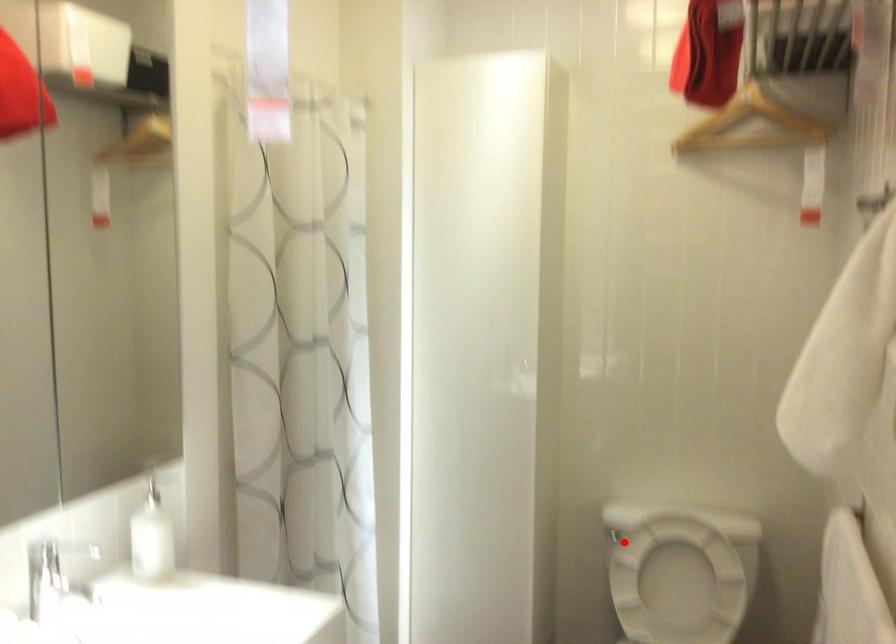
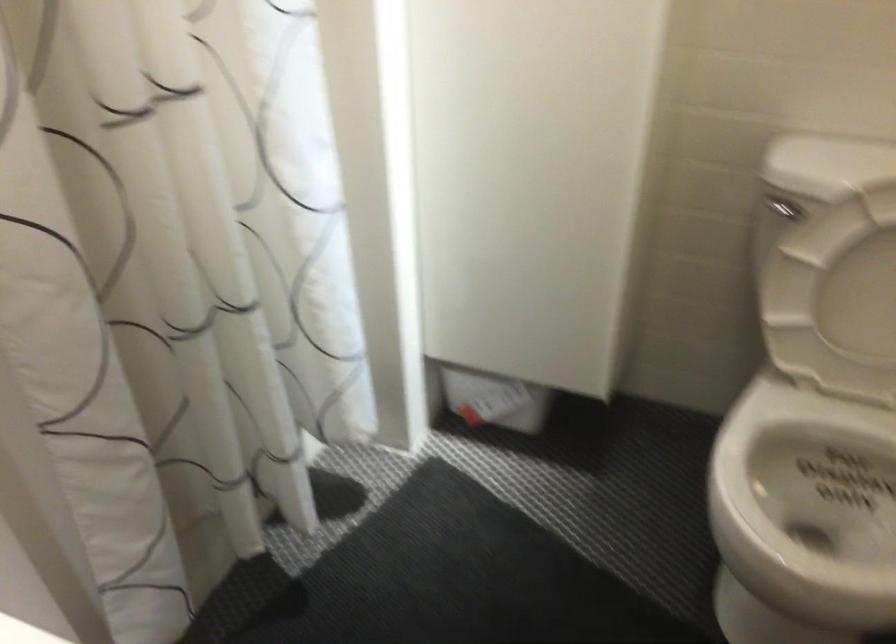
Question: I am providing you with two images of the same scene from different viewpoints. Given a red point in image1, look at the same physical point in image2. Is it:

Choices:
 (A) Closer to the viewpoint
 (B) Farther from the viewpoint

Answer: (A)